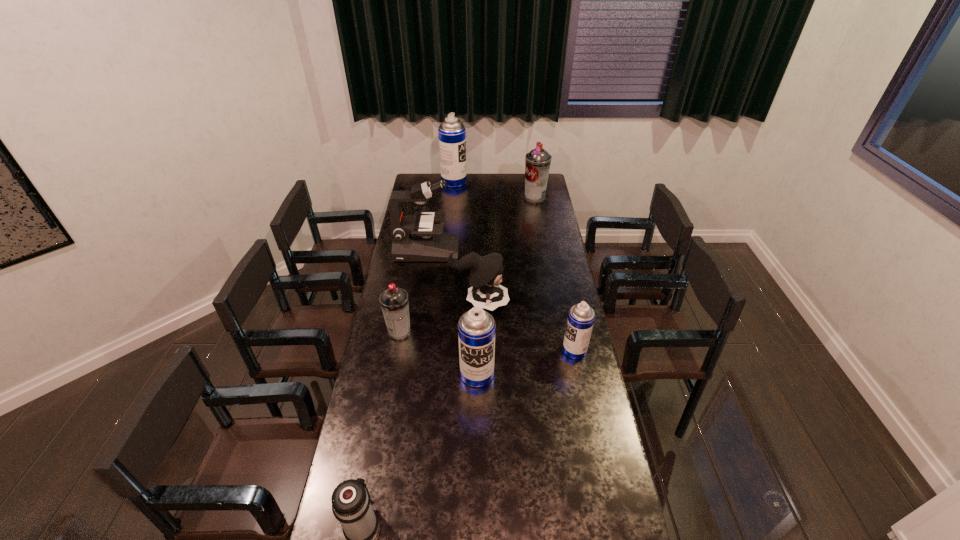
Locate an element on the screen. This screenshot has width=960, height=540. the smaller gray aerosol can is located at coordinates (394, 302).

At what (x,y) coordinates should I click in order to perform the action: click on the left gray aerosol can. Please return your answer as a coordinate pair (x, y). The width and height of the screenshot is (960, 540). Looking at the image, I should click on (394, 302).

Where is `free region located on the label side of the tallest aerosol can`? free region located on the label side of the tallest aerosol can is located at coordinates (485, 181).

Where is `free location located 0.380m through the eyepieces of the sixth nearest object`? free location located 0.380m through the eyepieces of the sixth nearest object is located at coordinates (531, 251).

Locate an element on the screen. Image resolution: width=960 pixels, height=540 pixels. free region located 0.200m on the left of the second farthest aerosol can is located at coordinates point(490,198).

Identify the location of free location located on the label side of the nearest aerosol can. The height and width of the screenshot is (540, 960). (476, 496).

At what (x,y) coordinates should I click in order to perform the action: click on vacant space located 0.070m at the face of the fourth farthest object. Please return your answer as a coordinate pair (x, y). Looking at the image, I should click on (524, 302).

I want to click on free space located 0.370m on the label side of the smallest blue aerosol can, so click(x=472, y=350).

This screenshot has width=960, height=540. I want to click on vacant space located 0.110m on the label side of the smallest blue aerosol can, so click(x=536, y=350).

Where is `vacant space located 0.060m on the label side of the smallest blue aerosol can`? The width and height of the screenshot is (960, 540). vacant space located 0.060m on the label side of the smallest blue aerosol can is located at coordinates (548, 350).